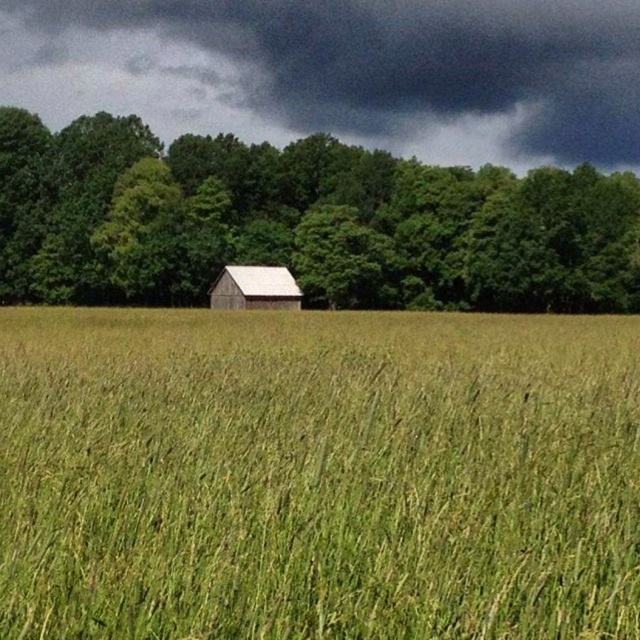
You are a farmer checking the field. You need to know which area is wider between the green grassy wheat field at center and the white wooden barn at center. Which one is wider?

The green grassy wheat field at center is wider than the white wooden barn at center according to the description.

You are standing in the rural landscape and notice the green matte tree at center and the dark gray cloud at upper center. Which object is located to the left of the other?

The green matte tree at center is positioned on the left side of dark gray cloud at upper center.